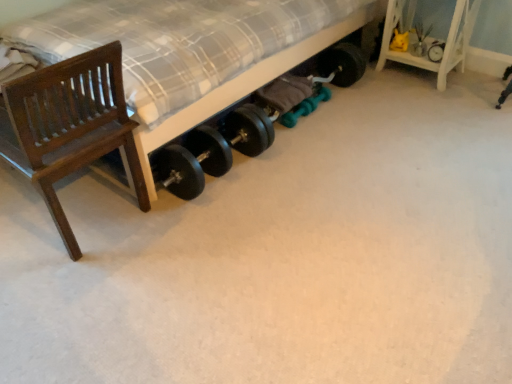
Image resolution: width=512 pixels, height=384 pixels. Identify the location of vacant space in front of matte black dumbbells at lower center. (288, 248).